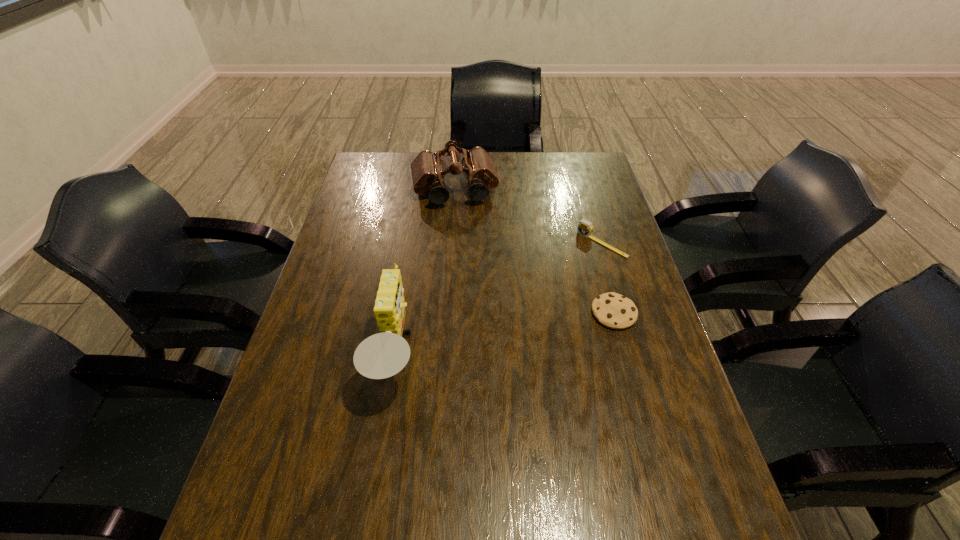
Where is `vacant space in between the third tallest object and the tallest object`? vacant space in between the third tallest object and the tallest object is located at coordinates (499, 300).

Image resolution: width=960 pixels, height=540 pixels. In order to click on object identified as the third closest to the third shortest object in this screenshot , I will do pos(615,311).

Identify which object is the third closest to the shortest object. Please provide its 2D coordinates. Your answer should be formatted as a tuple, i.e. [(x, y)], where the tuple contains the x and y coordinates of a point satisfying the conditions above.

[(427, 170)]

Locate an element on the screen. This screenshot has width=960, height=540. vacant position in the image that satisfies the following two spatial constraints: 1. on the front side of the second tallest object; 2. on the left side of the second shortest object is located at coordinates (450, 244).